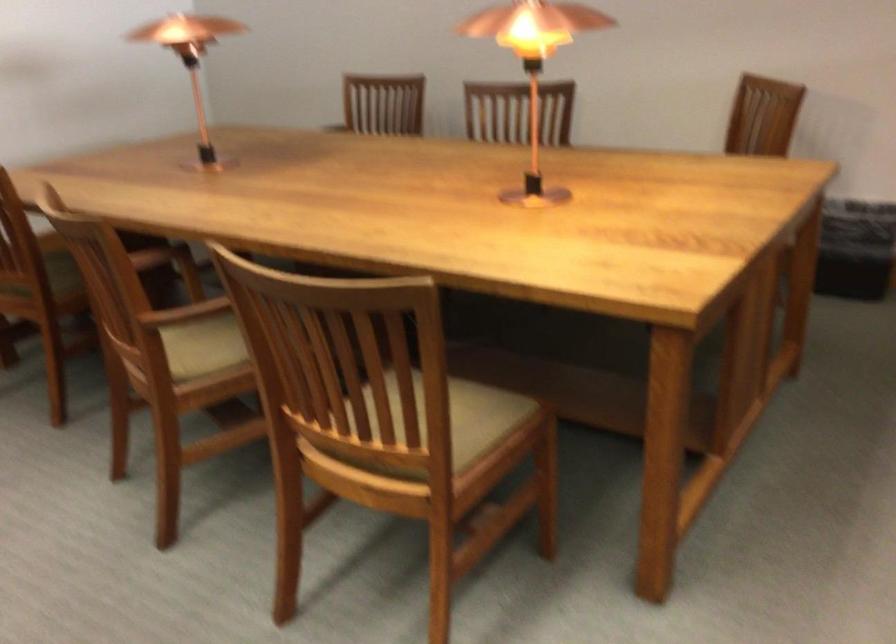
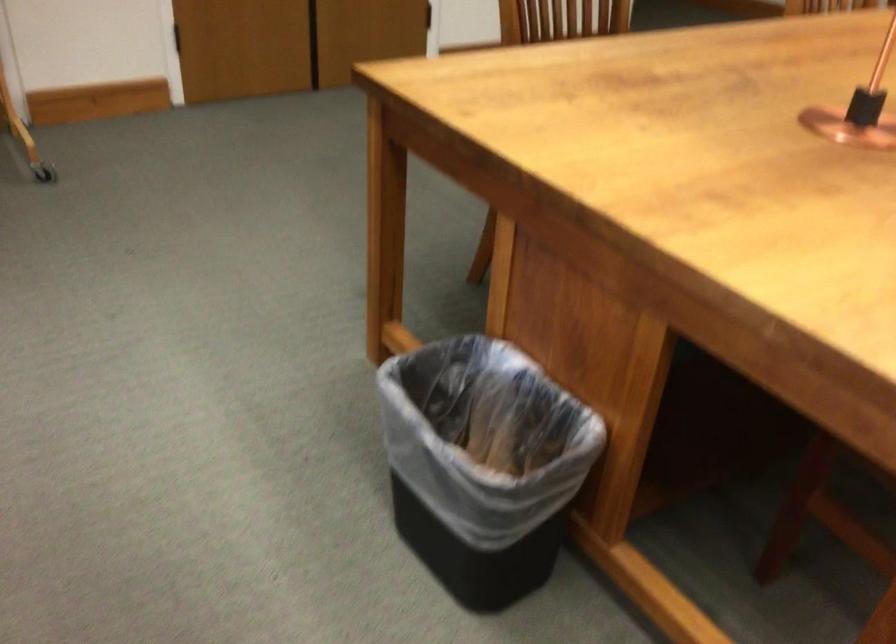
First-person continuous shooting, in which direction is the camera rotating?

The rotation direction of the camera is left-down.